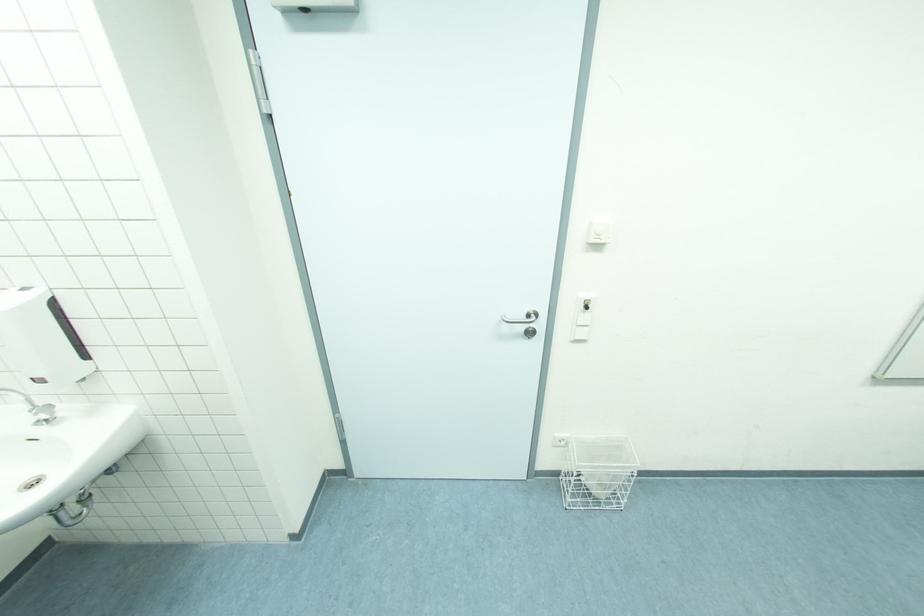
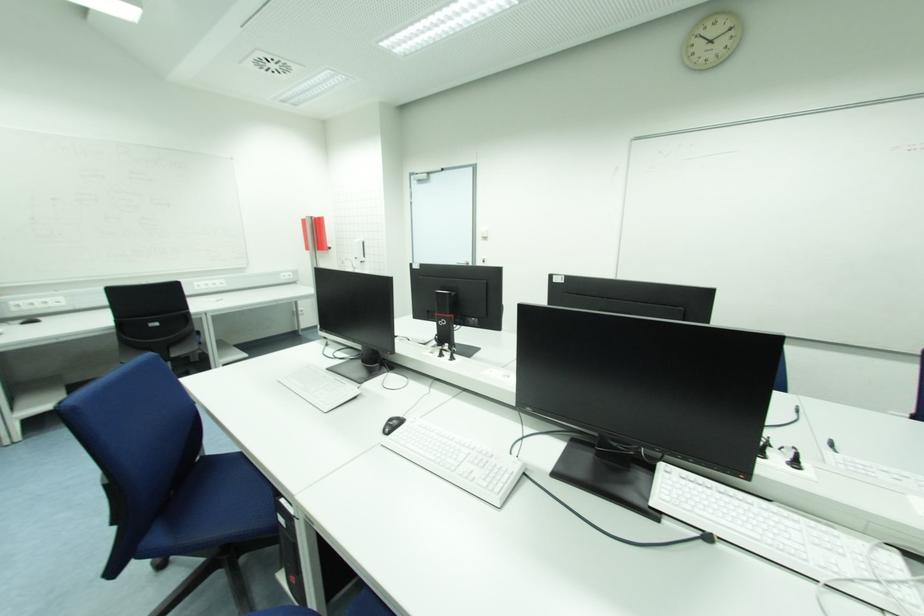
Question: I am providing you with two images of the same scene from different viewpoints. Which of the following objects are not visible in image2?

Choices:
 (A) silver door handle
 (B) blue chair sitting surface
 (C) black bin lid
 (D) power outlet

Answer: (D)